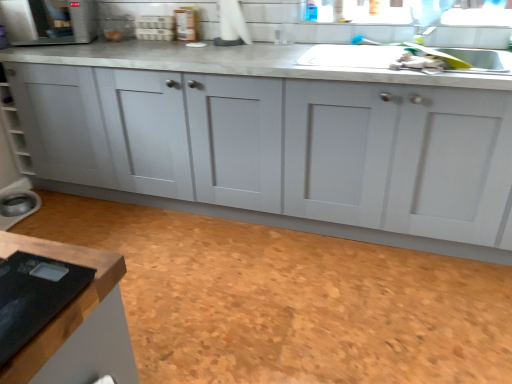
Question: From the image's perspective, is white plastic egg carton at upper center, acting as the third appliance starting from the bottom, beneath brown cork floor at lower center?

Choices:
 (A) yes
 (B) no

Answer: (B)

Question: Can you confirm if white plastic egg carton at upper center, the 2th appliance when ordered from right to left, is taller than brown cork floor at lower center?

Choices:
 (A) yes
 (B) no

Answer: (A)

Question: Is white plastic egg carton at upper center, the second appliance viewed from the top, next to brown cork floor at lower center?

Choices:
 (A) no
 (B) yes

Answer: (A)

Question: From a real-world perspective, is white plastic egg carton at upper center, the 2th appliance when ordered from right to left, on brown cork floor at lower center?

Choices:
 (A) yes
 (B) no

Answer: (A)

Question: Is white plastic egg carton at upper center, the second appliance viewed from the top, positioned before brown cork floor at lower center?

Choices:
 (A) yes
 (B) no

Answer: (B)

Question: In the image, is white plastic egg carton at upper center, the second appliance viewed from the top, on the left side or the right side of satin silver microwave at upper left, the 2th appliance viewed from the left?

Choices:
 (A) left
 (B) right

Answer: (B)

Question: From a real-world perspective, is white plastic egg carton at upper center, acting as the third appliance starting from the bottom, positioned above or below satin silver microwave at upper left, which ranks as the first appliance in top-to-bottom order?

Choices:
 (A) below
 (B) above

Answer: (A)

Question: Is white plastic egg carton at upper center, acting as the third appliance starting from the bottom, taller or shorter than satin silver microwave at upper left, which is counted as the 4th appliance, starting from the bottom?

Choices:
 (A) short
 (B) tall

Answer: (A)

Question: Looking at the image, does white plastic egg carton at upper center, the second appliance viewed from the top, seem bigger or smaller compared to satin silver microwave at upper left, the 2th appliance viewed from the left?

Choices:
 (A) big
 (B) small

Answer: (B)

Question: Based on their sizes in the image, would you say matte brown jar at upper center, positioned as the 2th appliance in bottom-to-top order, is bigger or smaller than white plastic egg carton at upper center, acting as the third appliance starting from the bottom?

Choices:
 (A) big
 (B) small

Answer: (B)

Question: From the image's perspective, is matte brown jar at upper center, placed as the 4th appliance when sorted from left to right, above or below white plastic egg carton at upper center, the 2th appliance when ordered from right to left?

Choices:
 (A) above
 (B) below

Answer: (B)

Question: Is matte brown jar at upper center, positioned as the 2th appliance in bottom-to-top order, wider or thinner than white plastic egg carton at upper center, the 2th appliance when ordered from right to left?

Choices:
 (A) thin
 (B) wide

Answer: (A)

Question: Is matte brown jar at upper center, placed as the 4th appliance when sorted from left to right, to the left or to the right of white plastic egg carton at upper center, acting as the third appliance starting from the bottom, in the image?

Choices:
 (A) left
 (B) right

Answer: (B)

Question: Considering their positions, is brown cork floor at lower center located in front of or behind satin silver microwave at upper left, placed as the 3th appliance when sorted from right to left?

Choices:
 (A) behind
 (B) front

Answer: (B)

Question: In terms of height, does brown cork floor at lower center look taller or shorter compared to satin silver microwave at upper left, which ranks as the first appliance in top-to-bottom order?

Choices:
 (A) short
 (B) tall

Answer: (A)